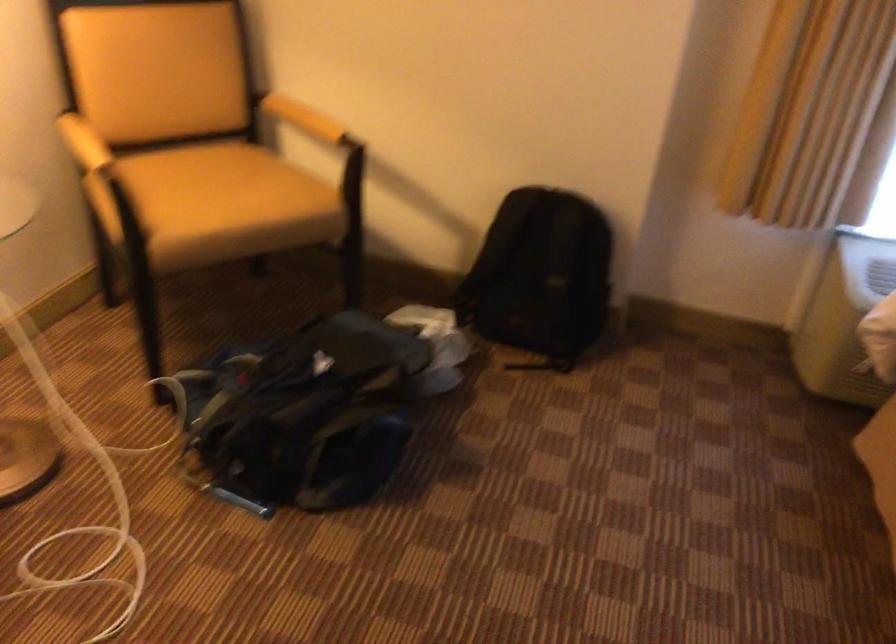
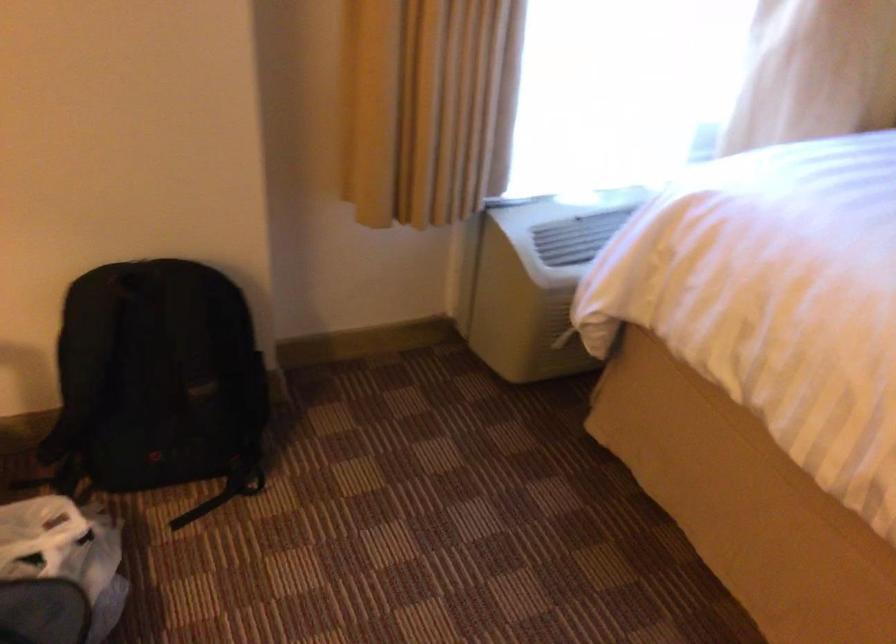
Where in the second image is the point corresponding to the point at 540,196 from the first image?

(135, 281)